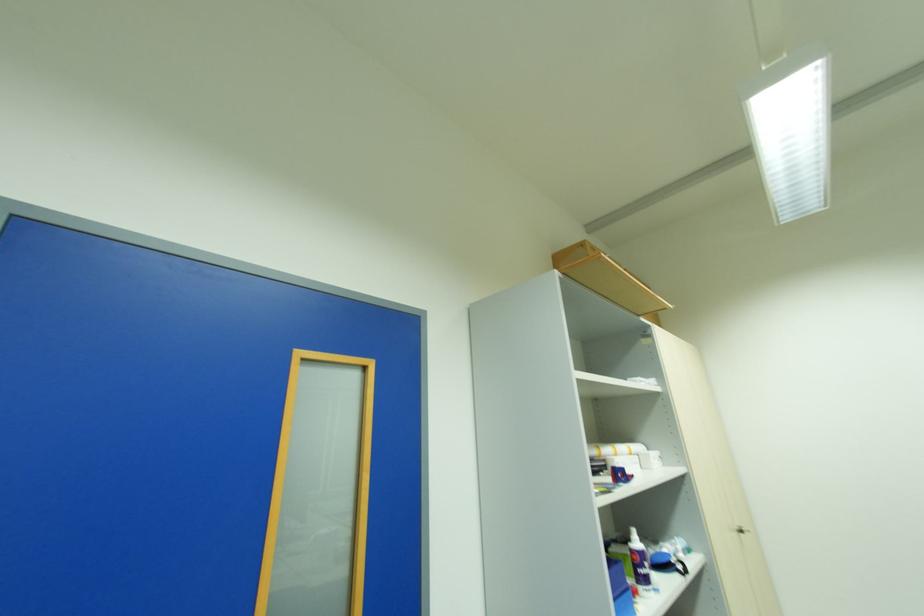
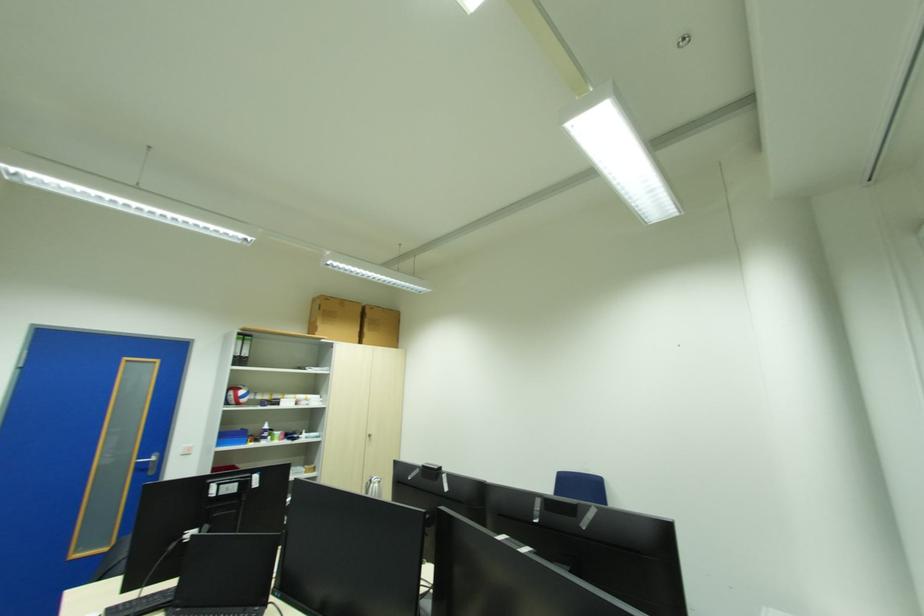
In a continuous first-person perspective shot, in which direction is the camera moving?

The movement direction of the cameraman is right, backward.